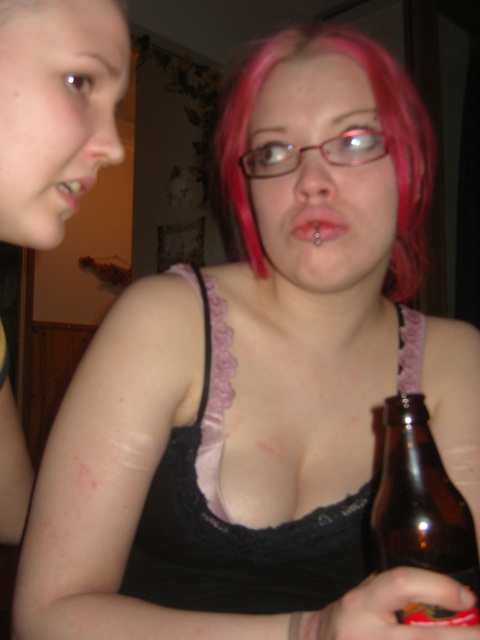
You are designing a display stand that must accommodate both the brown glass bottle at lower right and the matte pink lips at center. Given their sizes, which object requires a wider space for placement?

The matte pink lips at center require a wider space because the brown glass bottle at lower right is narrower than the matte pink lips at center.

You are standing in the room and want to take a photo of the point at coordinates [275,58]. The camera you are using has a minimum focus distance of 20 inches. Will the camera be able to focus on the point?

The point at coordinates [275,58] is 21.75 inches from the camera, which is beyond the minimum focus distance of 20 inches. Therefore, the camera should be able to focus on the point.